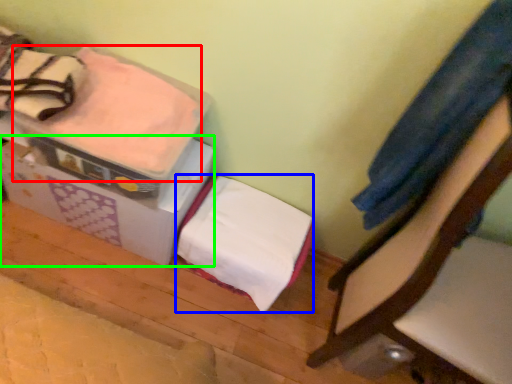
Question: Which object is the farthest from blanket (highlighted by a red box)? Choose among these: blanket (highlighted by a blue box) or cardboard box (highlighted by a green box).

Choices:
 (A) blanket
 (B) cardboard box

Answer: (A)